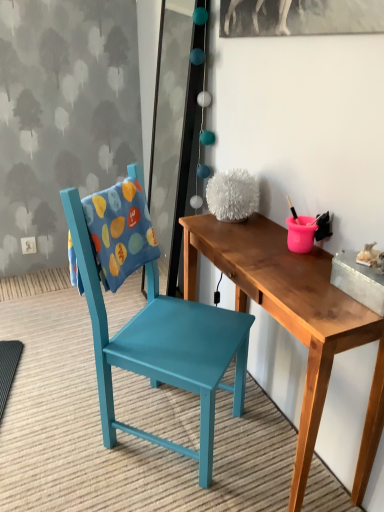
Question: Is the depth of wooden table at center greater than that of teal painted wood chair at left?

Choices:
 (A) yes
 (B) no

Answer: (B)

Question: From the image's perspective, does wooden table at center appear higher than teal painted wood chair at left?

Choices:
 (A) yes
 (B) no

Answer: (B)

Question: Is wooden table at center in contact with teal painted wood chair at left?

Choices:
 (A) yes
 (B) no

Answer: (B)

Question: Is wooden table at center to the left of teal painted wood chair at left from the viewer's perspective?

Choices:
 (A) yes
 (B) no

Answer: (B)

Question: Does wooden table at center have a larger size compared to teal painted wood chair at left?

Choices:
 (A) yes
 (B) no

Answer: (B)

Question: Is wooden table at center not inside teal painted wood chair at left?

Choices:
 (A) no
 (B) yes

Answer: (B)

Question: Can you confirm if teal painted wood chair at left is positioned to the right of wooden table at center?

Choices:
 (A) yes
 (B) no

Answer: (B)

Question: From a real-world perspective, is teal painted wood chair at left on wooden table at center?

Choices:
 (A) yes
 (B) no

Answer: (A)

Question: From the image's perspective, is teal painted wood chair at left beneath wooden table at center?

Choices:
 (A) no
 (B) yes

Answer: (A)

Question: Does teal painted wood chair at left have a lesser height compared to wooden table at center?

Choices:
 (A) no
 (B) yes

Answer: (A)

Question: Is teal painted wood chair at left turned away from wooden table at center?

Choices:
 (A) no
 (B) yes

Answer: (A)

Question: Considering the relative positions of teal painted wood chair at left and wooden table at center in the image provided, is teal painted wood chair at left to the left of wooden table at center from the viewer's perspective?

Choices:
 (A) no
 (B) yes

Answer: (B)

Question: Looking at their shapes, would you say wooden table at center is wider or thinner than teal painted wood chair at left?

Choices:
 (A) thin
 (B) wide

Answer: (A)